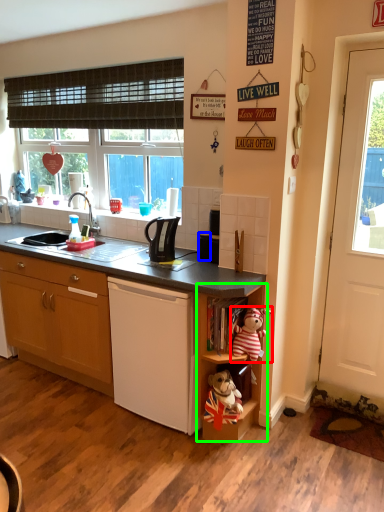
Question: Which object is the farthest from toy (highlighted by a red box)? Choose among these: appliance (highlighted by a blue box) or shelf (highlighted by a green box).

Choices:
 (A) appliance
 (B) shelf

Answer: (A)